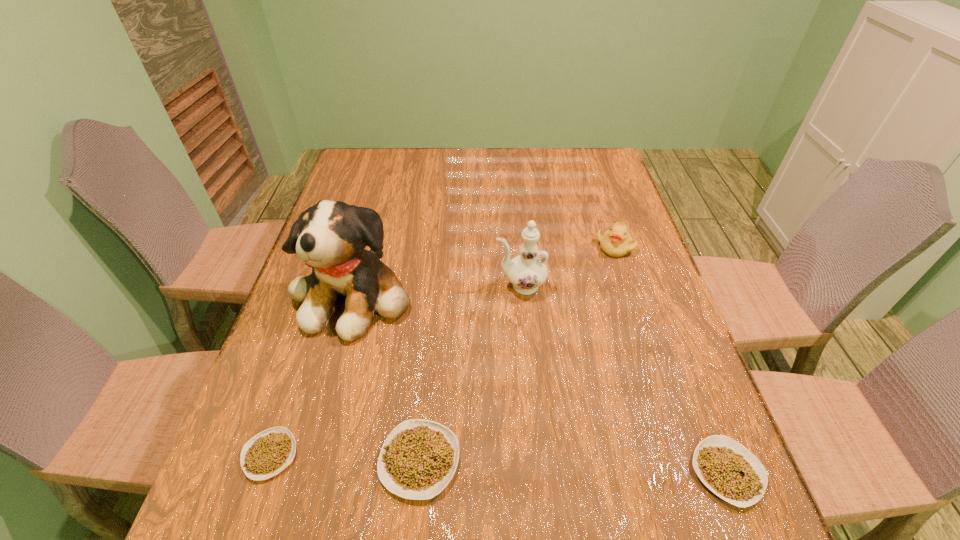
Identify the location of object that is the second nearest to the tallest object. The image size is (960, 540). pyautogui.click(x=269, y=452).

This screenshot has height=540, width=960. Find the location of `the closest legume relative to the puppy`. the closest legume relative to the puppy is located at coordinates (418, 459).

Identify which legume is located as the second nearest to the leftmost legume. Please provide its 2D coordinates. Your answer should be formatted as a tuple, i.e. [(x, y)], where the tuple contains the x and y coordinates of a point satisfying the conditions above.

[(727, 468)]

Locate an element on the screen. The image size is (960, 540). free region that satisfies the following two spatial constraints: 1. on the front-facing side of the duckling; 2. at the spout of the second tallest object is located at coordinates (627, 286).

Where is `free space that satisfies the following two spatial constraints: 1. on the front side of the second tallest legume; 2. on the right side of the shortest object`? This screenshot has height=540, width=960. free space that satisfies the following two spatial constraints: 1. on the front side of the second tallest legume; 2. on the right side of the shortest object is located at coordinates (264, 472).

You are a GUI agent. You are given a task and a screenshot of the screen. Output one action in this format:
    pyautogui.click(x=<x>, y=<y>)
    Task: Click on the vacant region that satisfies the following two spatial constraints: 1. at the face of the rightmost legume; 2. on the left side of the puppy
    The height and width of the screenshot is (540, 960).
    Given the screenshot: What is the action you would take?
    pyautogui.click(x=305, y=472)

Identify the location of vacant space that satisfies the following two spatial constraints: 1. at the face of the rightmost legume; 2. on the right side of the tallest object. This screenshot has width=960, height=540. (305, 472).

Identify the location of blank area in the image that satisfies the following two spatial constraints: 1. on the front side of the rightmost legume; 2. on the right side of the tallest legume. (419, 472).

This screenshot has width=960, height=540. Identify the location of vacant space that satisfies the following two spatial constraints: 1. at the spout of the chinaware; 2. at the face of the puppy. point(521,294).